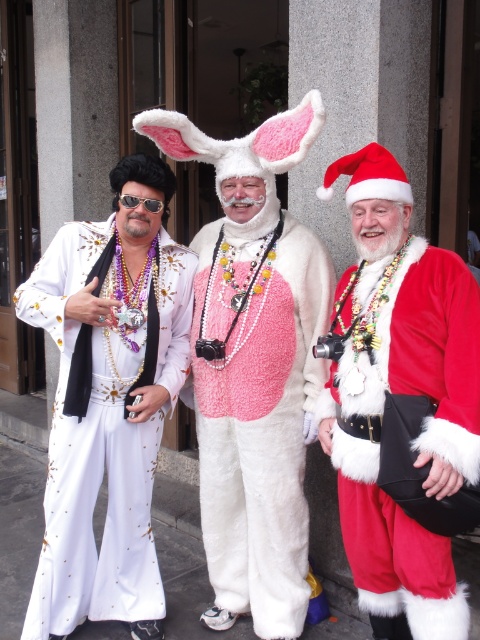
You are a photographer trying to capture a group photo of the three costumed individuals. You notice the red velvet santa suit at right and the velvet red santa suit at center. Which one is positioned lower in the image?

The red velvet santa suit at right is located below the velvet red santa suit at center, so it is positioned lower in the image.

You are organizing a costume party and need to arrange the red velvet santa suit at right and the white sequined jumpsuit at left in a row from thinnest to widest. Based on their widths, which order should they be placed in?

The red velvet santa suit at right is thinner than the white sequined jumpsuit at left, so the correct order from thinnest to widest would be red velvet santa suit at right first, followed by the white sequined jumpsuit at left.

You are organizing a costume parade and need to arrange the red velvet santa suit at right and the white sequined jumpsuit at left based on their sizes. Which costume should be placed first if you want to arrange them from smallest to largest?

The red velvet santa suit at right has a smaller size compared to the white sequined jumpsuit at left, so it should be placed first in the arrangement from smallest to largest.